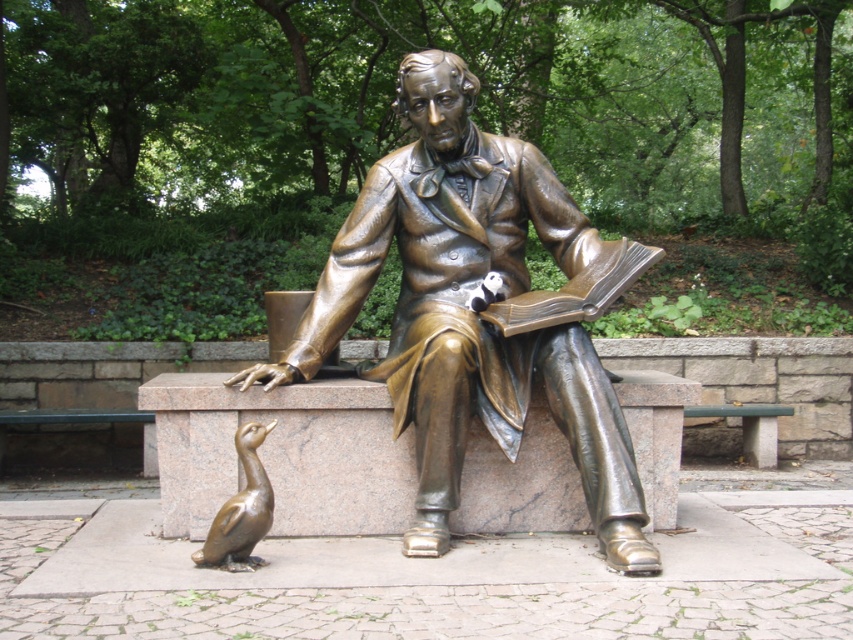
Who is shorter, bronze statue at center or shiny bronze duckling at lower left?

Standing shorter between the two is shiny bronze duckling at lower left.

Which is below, bronze statue at center or shiny bronze duckling at lower left?

Positioned lower is shiny bronze duckling at lower left.

Is point (380, 218) closer to viewer compared to point (264, 531)?

No, (380, 218) is behind (264, 531).

The width and height of the screenshot is (853, 640). What are the coordinates of `bronze statue at center` in the screenshot? It's located at (469, 310).